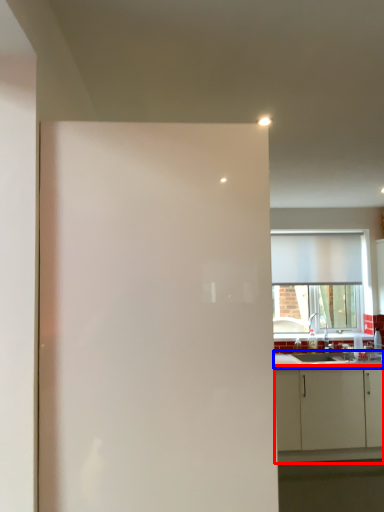
Question: Which object is closer to the camera taking this photo, cabinetry (highlighted by a red box) or countertop (highlighted by a blue box)?

Choices:
 (A) cabinetry
 (B) countertop

Answer: (A)